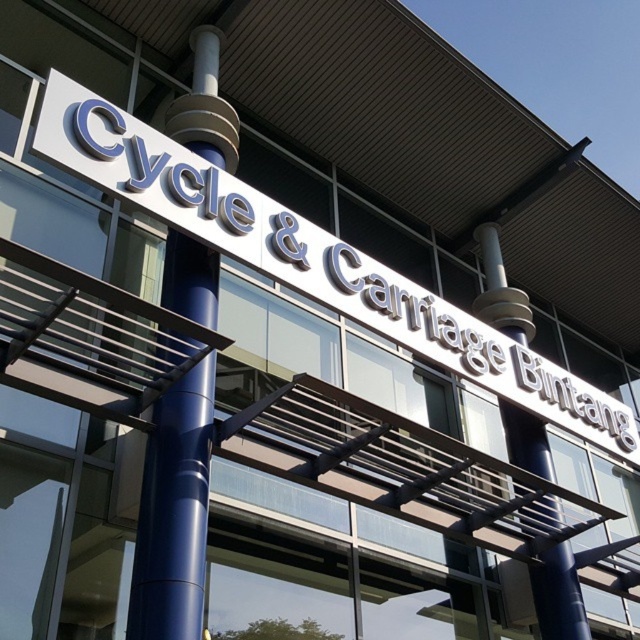
Is point (236, 236) in front of point (148, 572)?

No, (236, 236) is behind (148, 572).

Looking at this image, is white glossy sign at upper center shorter than blue polished metal pole at center?

In fact, white glossy sign at upper center may be taller than blue polished metal pole at center.

Is point (224, 195) less distant than point (179, 605)?

No.

Find the location of a particular element. white glossy sign at upper center is located at coordinates (312, 260).